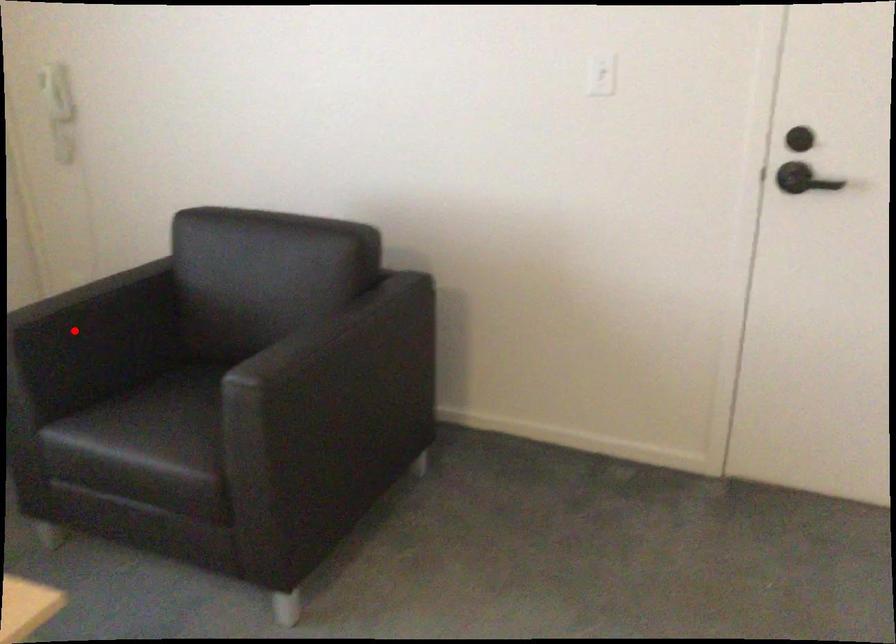
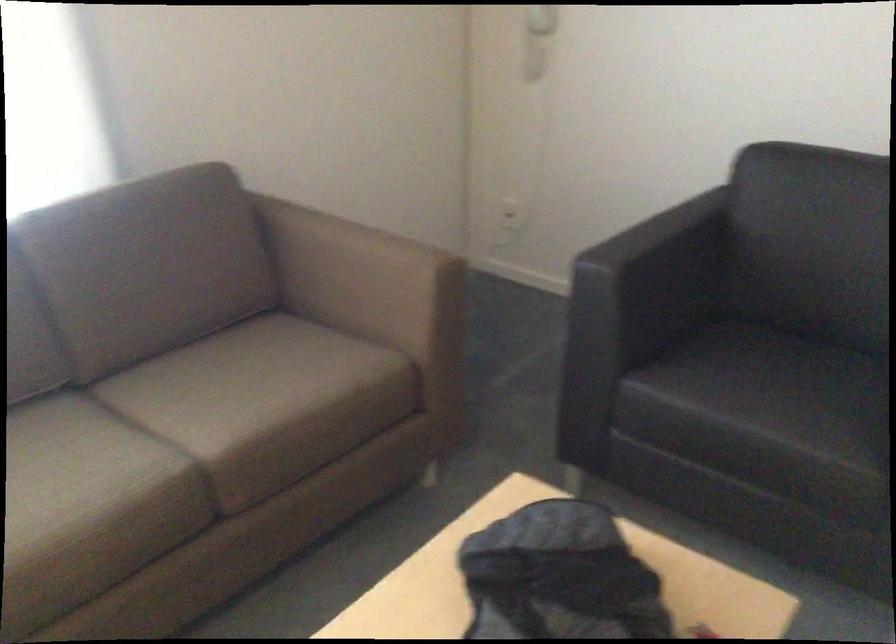
The point at the highlighted location is marked in the first image. Where is the corresponding point in the second image?

(652, 270)